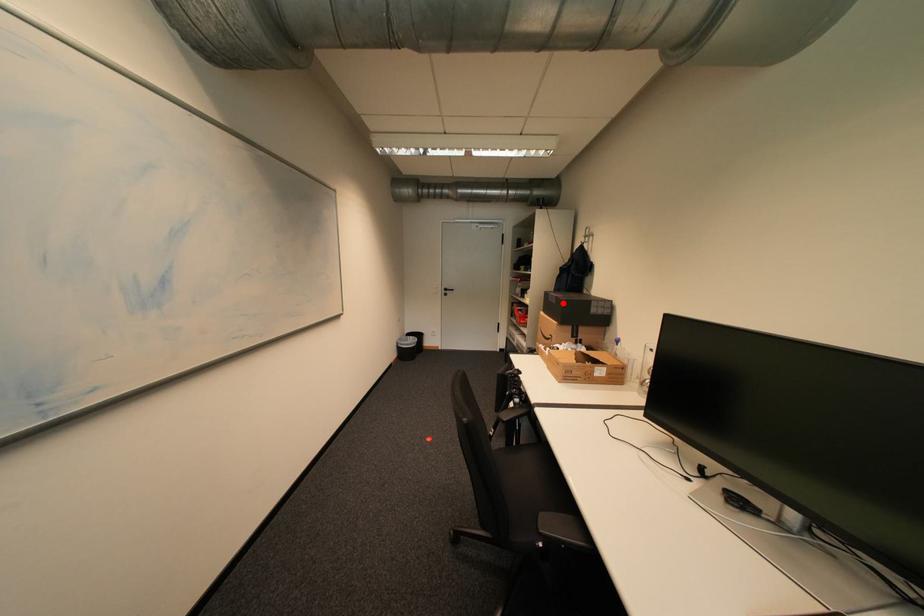
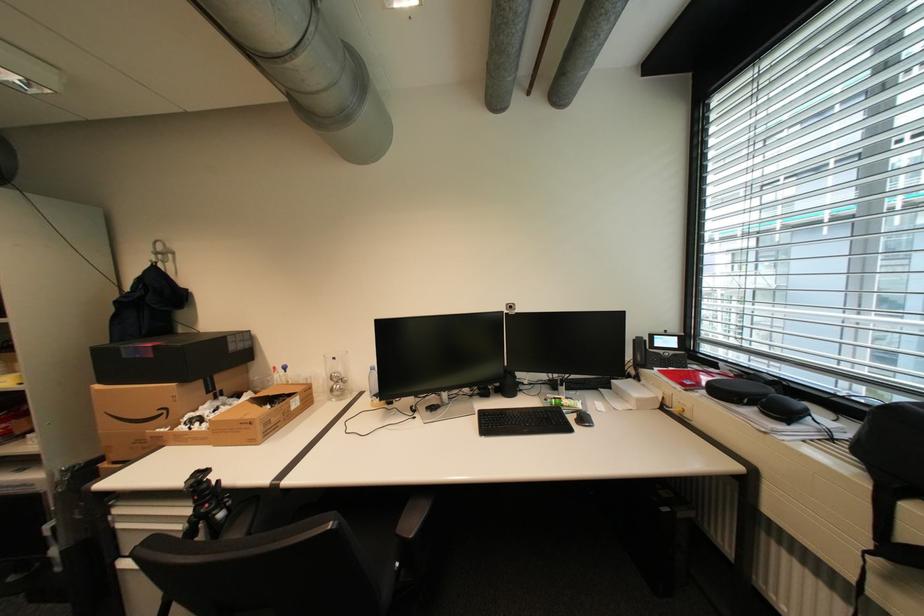
Locate, in the second image, the point that corresponds to the highlighted location in the first image.

(161, 357)